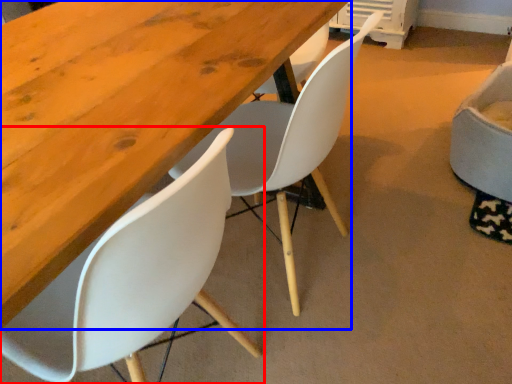
Question: Which object is further to the camera taking this photo, chair (highlighted by a red box) or table (highlighted by a blue box)?

Choices:
 (A) chair
 (B) table

Answer: (B)